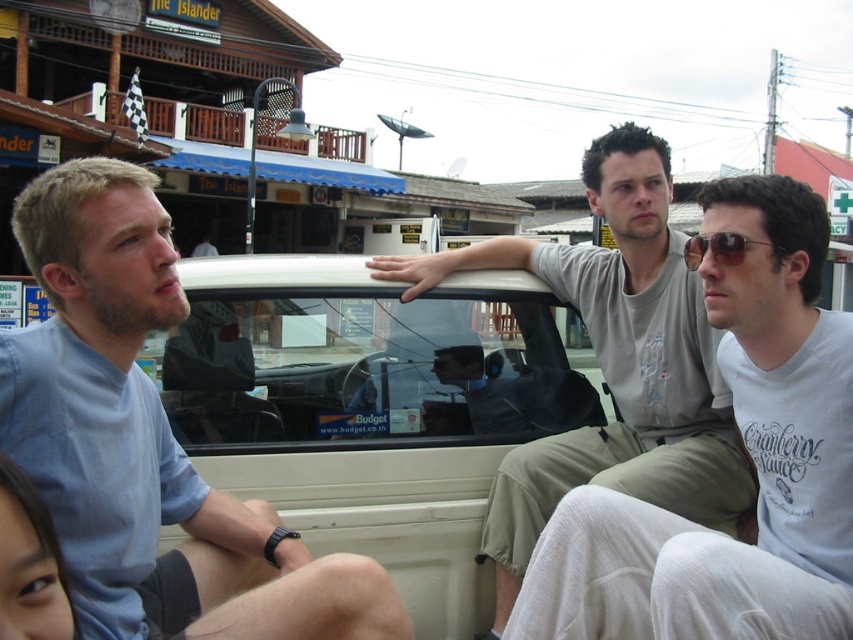
You are a photographer trying to capture a candid shot of the group in the truck. You notice the light blue shirt at left and the sunglasses at center. Which object should you focus on first to ensure both are in the frame?

The light blue shirt at left should be focused on first since it is in front of the sunglasses at center, ensuring both are captured in the frame.

You are standing 2 meters away from the camera. You want to take a photo of the point at coordinates point (277, 596). Will you be able to reach it without moving closer?

The point (277, 596) is 1.92 meters from the camera. Since you are standing 2 meters away, you can reach it without moving closer.

You are standing in front of the truck parked at The Islander. Where exactly is the light blue shirt at left located in the truck?

The light blue shirt at left is located at point (146, 442) in the truck.